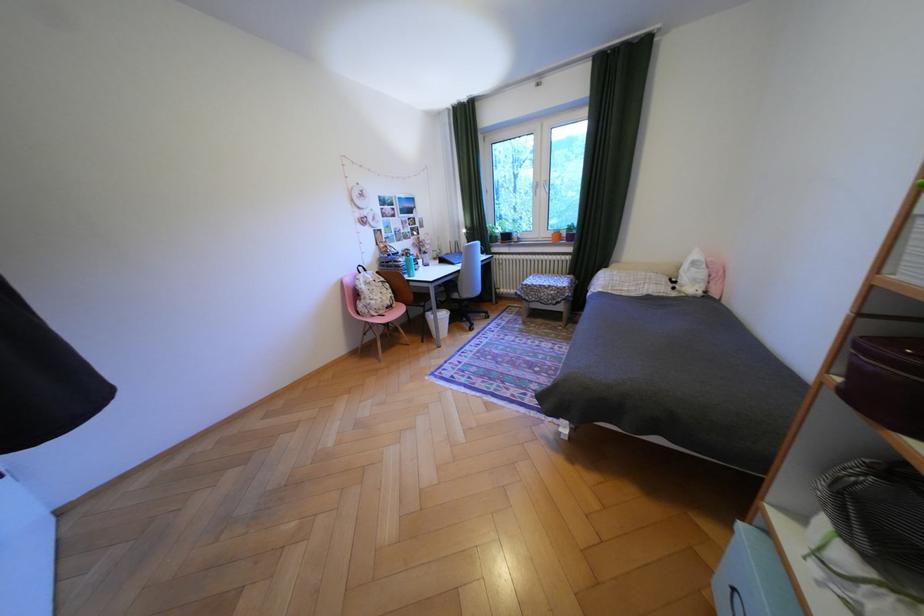
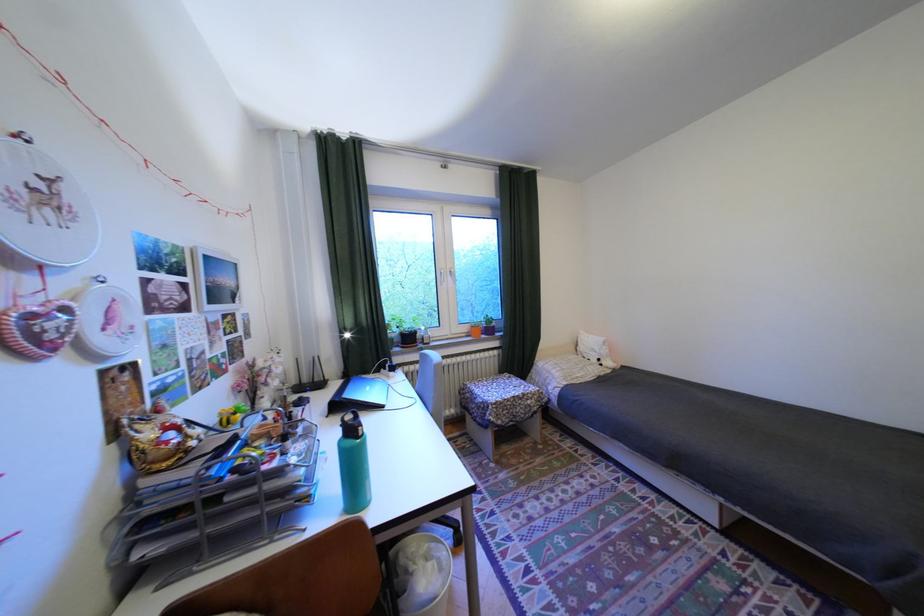
The point at (502, 225) is marked in the first image. Where is the corresponding point in the second image?

(397, 322)